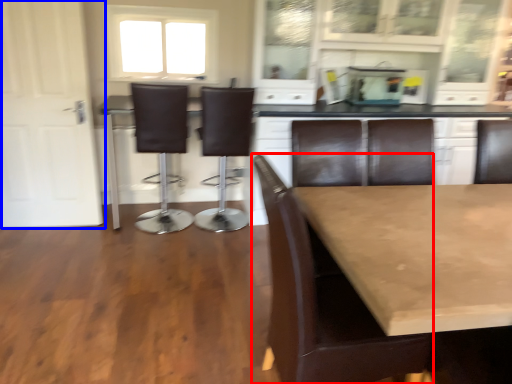
Question: Which object appears closest to the camera in this image, chair (highlighted by a red box) or door (highlighted by a blue box)?

Choices:
 (A) chair
 (B) door

Answer: (A)